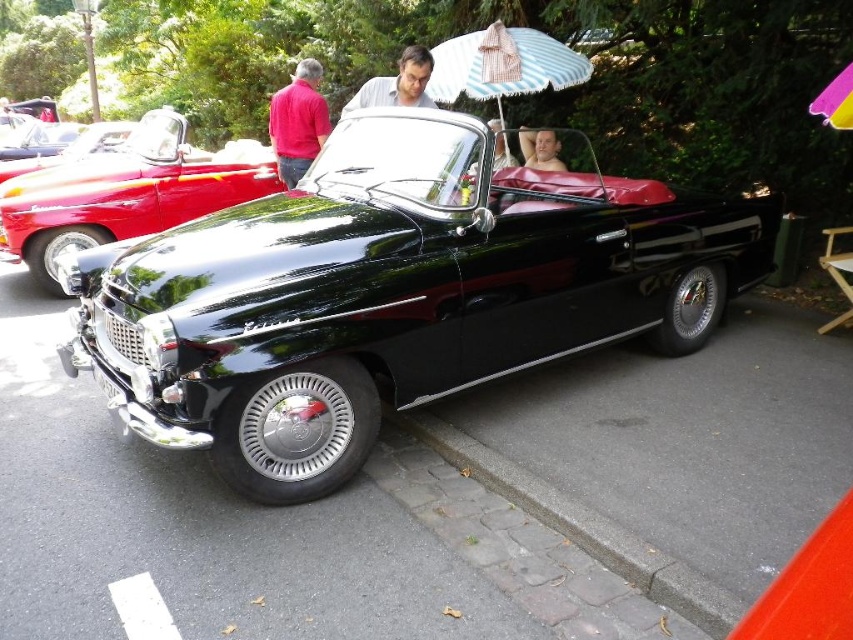
Which is below, glossy black convertible at center or matte red shirt at upper left?

glossy black convertible at center

Who is more distant from viewer, (x=264, y=257) or (x=294, y=129)?

Positioned behind is point (x=294, y=129).

In order to click on glossy black convertible at center in this screenshot , I will do `click(393, 291)`.

Who is more forward, (509, 497) or (288, 120)?

Positioned in front is point (509, 497).

Is brown cobblestone curb at lower center wider than matte red shirt at upper left?

Yes, brown cobblestone curb at lower center is wider than matte red shirt at upper left.

Who is more forward, (453,440) or (288,93)?

Positioned in front is point (453,440).

Locate an element on the screen. brown cobblestone curb at lower center is located at coordinates (581, 525).

Can you confirm if striped fabric umbrella at upper center is smaller than smooth gray shirt at center?

Actually, striped fabric umbrella at upper center might be larger than smooth gray shirt at center.

Is striped fabric umbrella at upper center above smooth gray shirt at center?

Correct, striped fabric umbrella at upper center is located above smooth gray shirt at center.

The image size is (853, 640). In order to click on striped fabric umbrella at upper center in this screenshot , I will do `click(503, 65)`.